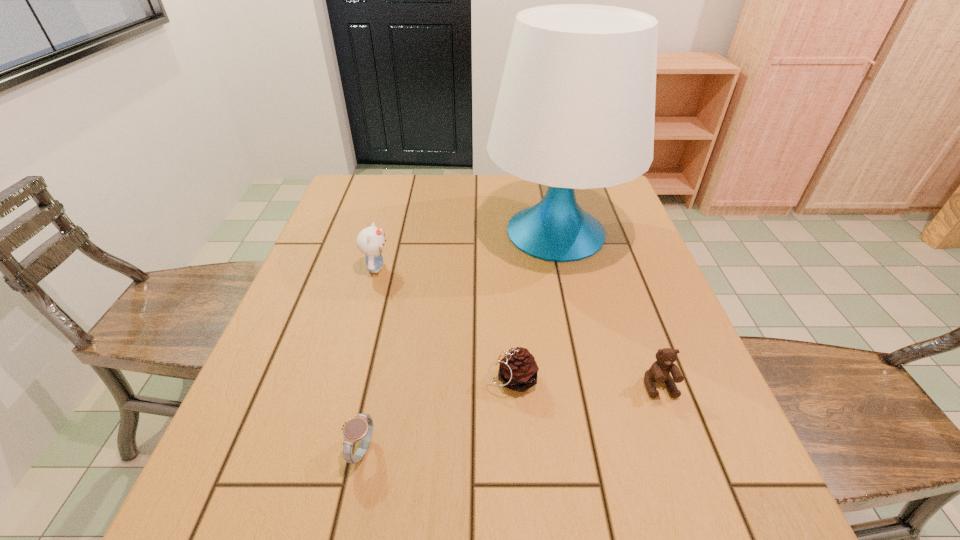
Locate an element on the screen. The image size is (960, 540). vacant region between the kitten and the teddy bear is located at coordinates (517, 327).

This screenshot has height=540, width=960. Identify the location of vacant area that lies between the pinecone and the leftmost object. (444, 323).

Image resolution: width=960 pixels, height=540 pixels. Identify the location of unoccupied area between the pinecone and the watch. pos(437,415).

Find the location of a particular element. The width and height of the screenshot is (960, 540). free spot between the pinecone and the tallest object is located at coordinates (535, 306).

Identify the location of object that ranks as the closest to the fourth shortest object. The image size is (960, 540). (576, 107).

You are a GUI agent. You are given a task and a screenshot of the screen. Output one action in this format:
    pyautogui.click(x=<x>, y=<y>)
    Task: Click on the object identified as the closest to the pinecone
    The width and height of the screenshot is (960, 540).
    Given the screenshot: What is the action you would take?
    pyautogui.click(x=659, y=372)

Locate an element on the screen. The height and width of the screenshot is (540, 960). vacant area that satisfies the following two spatial constraints: 1. on the front-facing side of the shortest object; 2. on the left side of the second tallest object is located at coordinates (326, 450).

Where is `free space that satisfies the following two spatial constraints: 1. on the front-facing side of the watch; 2. on the right side of the kitten`? This screenshot has width=960, height=540. free space that satisfies the following two spatial constraints: 1. on the front-facing side of the watch; 2. on the right side of the kitten is located at coordinates (326, 450).

Find the location of a particular element. free space in the image that satisfies the following two spatial constraints: 1. on the front-facing side of the table lamp; 2. on the front-facing side of the second tallest object is located at coordinates (564, 268).